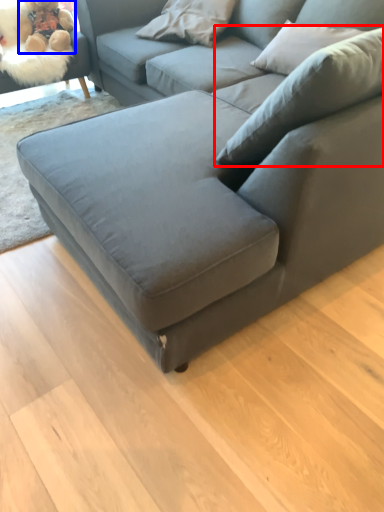
Question: Among these objects, which one is farthest to the camera, pillow (highlighted by a red box) or toy (highlighted by a blue box)?

Choices:
 (A) pillow
 (B) toy

Answer: (B)